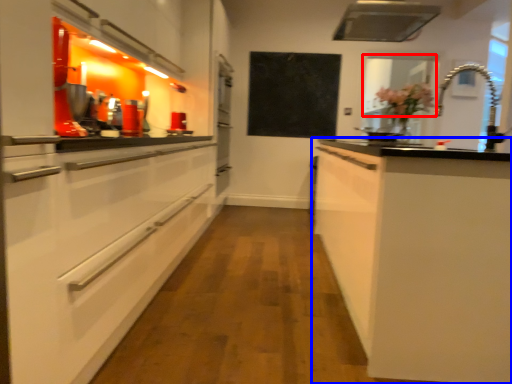
Question: Which point is further to the camera, window screen (highlighted by a red box) or cabinetry (highlighted by a blue box)?

Choices:
 (A) window screen
 (B) cabinetry

Answer: (A)